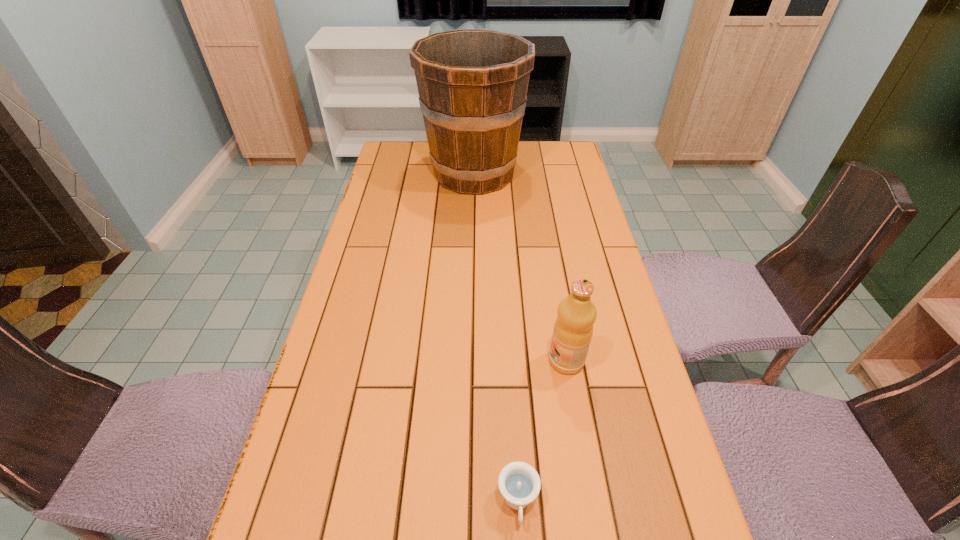
Where is `object that stands as the closest to the second tallest object`? object that stands as the closest to the second tallest object is located at coordinates (519, 483).

Image resolution: width=960 pixels, height=540 pixels. What are the coordinates of `object that stands as the closest to the nearest object` in the screenshot? It's located at (573, 329).

Find the location of a particular element. The image size is (960, 540). free space that satisfies the following two spatial constraints: 1. on the front label of the second shortest object; 2. on the side of the teacup with the handle is located at coordinates (590, 503).

You are a GUI agent. You are given a task and a screenshot of the screen. Output one action in this format:
    pyautogui.click(x=<x>, y=<y>)
    Task: Click on the vacant space that satisfies the following two spatial constraints: 1. on the front label of the fruit juice; 2. on the side of the teacup with the handle
    The image size is (960, 540).
    Given the screenshot: What is the action you would take?
    pyautogui.click(x=590, y=503)